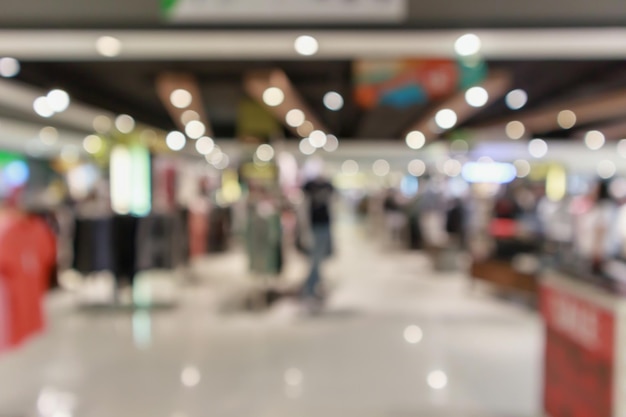
You are a GUI agent. You are given a task and a screenshot of the screen. Output one action in this format:
    pyautogui.click(x=<x>, y=<y>)
    Task: Click on the corner
    The height and width of the screenshot is (417, 626).
    Given the screenshot: What is the action you would take?
    pyautogui.click(x=206, y=169), pyautogui.click(x=616, y=163)